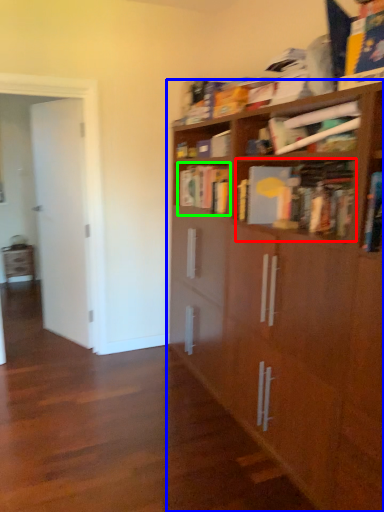
Question: Which object is the closest to the book (highlighted by a red box)? Choose among these: bookcase (highlighted by a blue box) or book (highlighted by a green box).

Choices:
 (A) bookcase
 (B) book

Answer: (A)